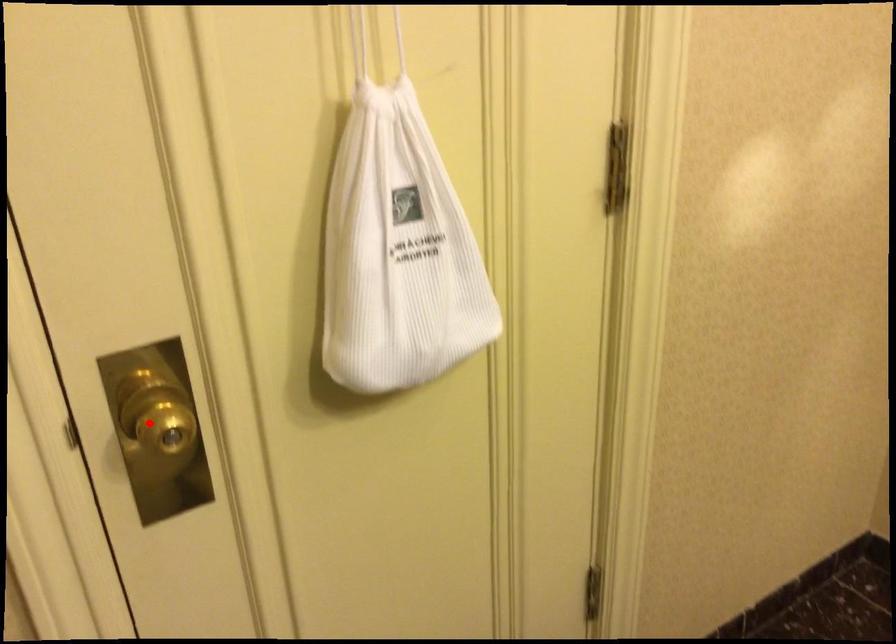
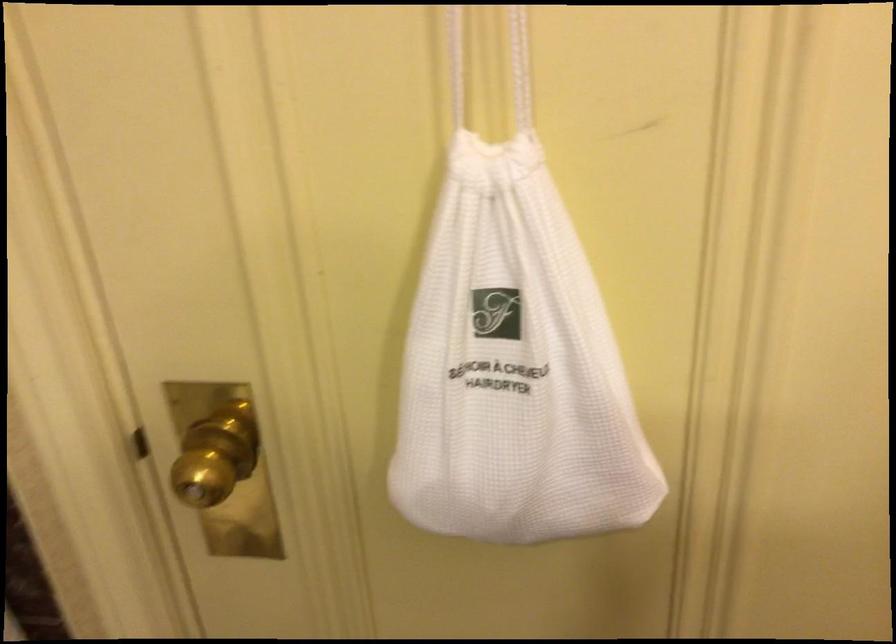
Where in the second image is the point corresponding to the highlighted location from the first image?

(216, 456)